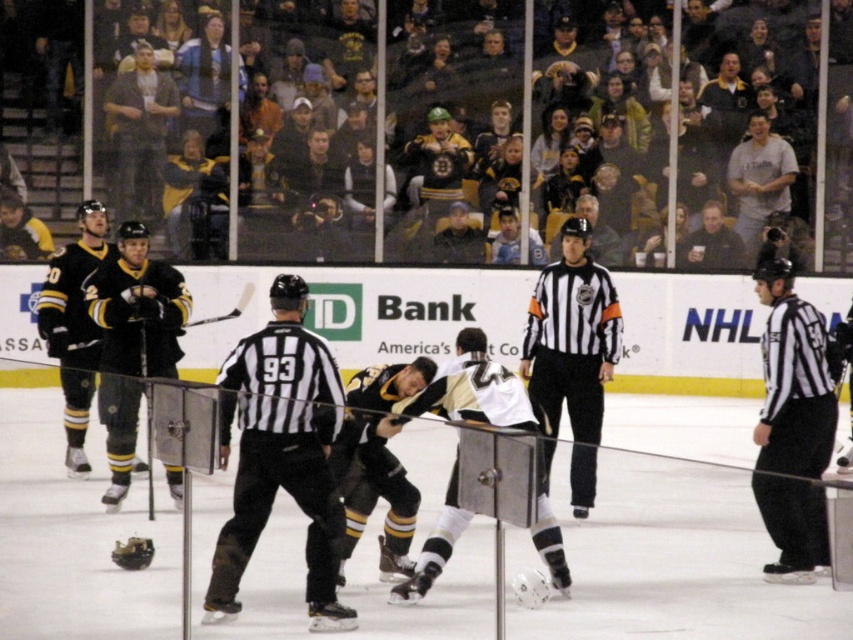
Question: Can you confirm if black jersey at left is smaller than dark brown leather jacket at upper center?

Choices:
 (A) no
 (B) yes

Answer: (B)

Question: Does black and white striped referee at center have a larger size compared to dark brown leather jacket at upper center?

Choices:
 (A) yes
 (B) no

Answer: (B)

Question: Among these objects, which one is farthest from the camera?

Choices:
 (A) matte black hockey stick at left
 (B) black jersey at left
 (C) black matte hockey stick at left

Answer: (B)

Question: Is black jersey at center wider than black matte hockey stick at left?

Choices:
 (A) no
 (B) yes

Answer: (B)

Question: Which of these objects is positioned farthest from the black and white striped referee at center?

Choices:
 (A) white jersey at center
 (B) black and white striped shirt at center

Answer: (B)

Question: Which of the following is the closest to the observer?

Choices:
 (A) (178, 355)
 (B) (727, 170)
 (C) (86, 205)

Answer: (A)